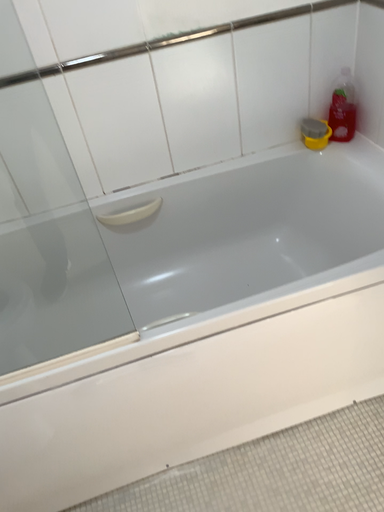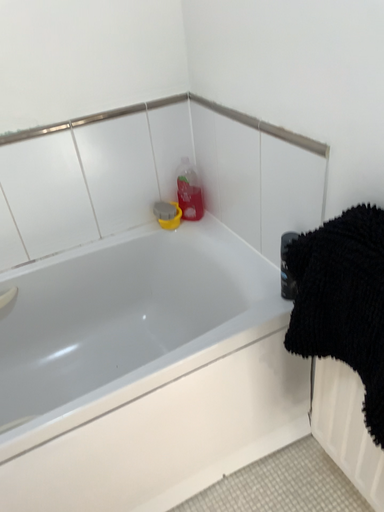
Question: How did the camera likely rotate when shooting the video?

Choices:
 (A) rotated upward
 (B) rotated downward

Answer: (A)